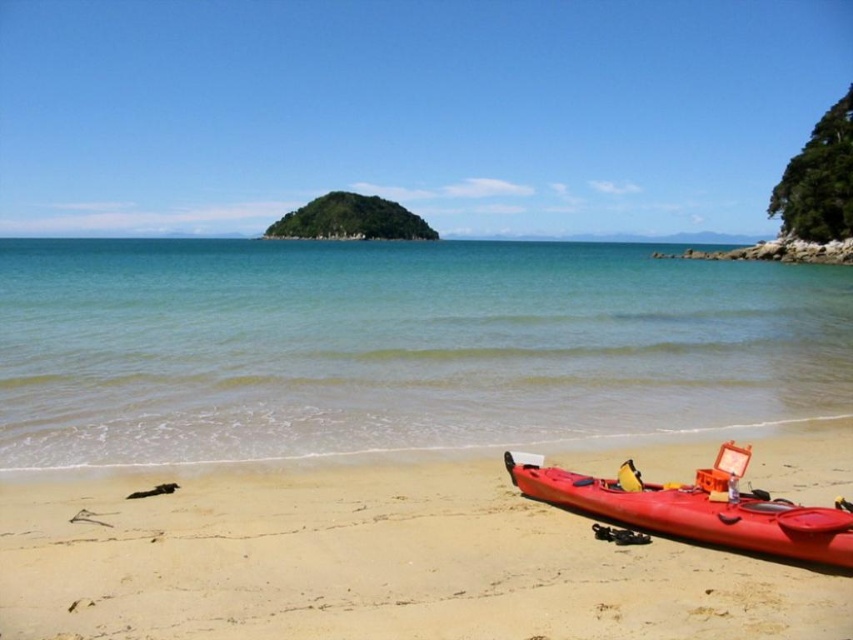
You are standing on the beach and want to reach the clear blue water at center. The matte orange kayak at lower right is in your way. Can you walk around it to get to the water?

The clear blue water at center is further to the viewer than the matte orange kayak at lower right, so the kayak is closer to you. You can walk around it to reach the water.

You are standing on the beach and want to place a small flag on the closest surface between the smooth sand at lower right and the matte orange kayak at lower right. Which surface should you choose?

The smooth sand at lower right is closer to the viewer than the matte orange kayak at lower right, so you should place the flag on the smooth sand at lower right.